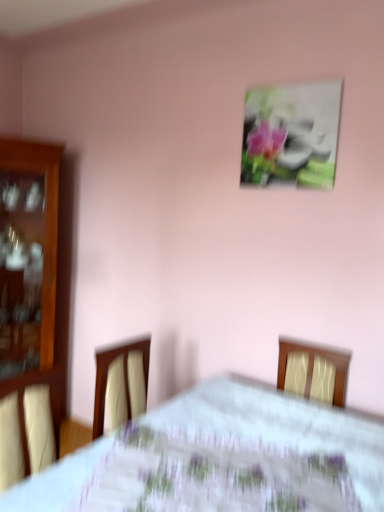
Question: Considering the relative sizes of white floral tablecloth at center and metallic silver frame at upper center in the image provided, is white floral tablecloth at center thinner than metallic silver frame at upper center?

Choices:
 (A) no
 (B) yes

Answer: (A)

Question: Is white floral tablecloth at center outside of metallic silver frame at upper center?

Choices:
 (A) yes
 (B) no

Answer: (A)

Question: Is white floral tablecloth at center far from metallic silver frame at upper center?

Choices:
 (A) no
 (B) yes

Answer: (B)

Question: Does white floral tablecloth at center have a greater height compared to metallic silver frame at upper center?

Choices:
 (A) yes
 (B) no

Answer: (A)

Question: Is white floral tablecloth at center in contact with metallic silver frame at upper center?

Choices:
 (A) yes
 (B) no

Answer: (B)

Question: Is metallic silver frame at upper center in front of or behind wooden cabinet at left in the image?

Choices:
 (A) front
 (B) behind

Answer: (A)

Question: Based on their sizes in the image, would you say metallic silver frame at upper center is bigger or smaller than wooden cabinet at left?

Choices:
 (A) big
 (B) small

Answer: (B)

Question: From a real-world perspective, is metallic silver frame at upper center positioned above or below wooden cabinet at left?

Choices:
 (A) above
 (B) below

Answer: (A)

Question: Is point (297, 148) closer or farther from the camera than point (56, 407)?

Choices:
 (A) farther
 (B) closer

Answer: (B)

Question: Considering the positions of wooden cabinet at left and white floral tablecloth at center in the image, is wooden cabinet at left wider or thinner than white floral tablecloth at center?

Choices:
 (A) wide
 (B) thin

Answer: (B)

Question: Is wooden cabinet at left bigger or smaller than white floral tablecloth at center?

Choices:
 (A) big
 (B) small

Answer: (B)

Question: Would you say wooden cabinet at left is inside or outside white floral tablecloth at center?

Choices:
 (A) outside
 (B) inside

Answer: (A)

Question: Is wooden cabinet at left to the left or to the right of white floral tablecloth at center in the image?

Choices:
 (A) right
 (B) left

Answer: (B)

Question: Is white floral tablecloth at center in front of or behind metallic silver frame at upper center in the image?

Choices:
 (A) front
 (B) behind

Answer: (A)

Question: Does point (198, 467) appear closer or farther from the camera than point (271, 152)?

Choices:
 (A) farther
 (B) closer

Answer: (B)